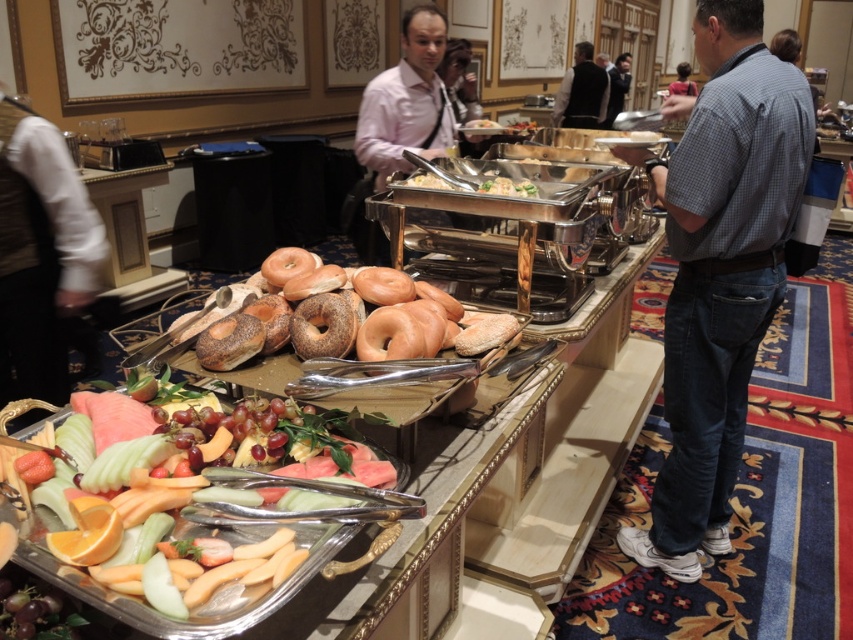
You are at a buffet and want to grab a bagel from the brown matte bagel at center. To reach it, you need to pass by the glossy metallic tray with assorted fruits at lower left. Is the path between them wide enough for you to walk through comfortably?

The glossy metallic tray with assorted fruits at lower left is positioned on the left side of brown matte bagel at center, so the path between them is likely wide enough for you to walk through comfortably as they are arranged side by side.

You are at the buffet table and want to reach both the fruit tray and the bagel arrangement. Which of the two points, point (706, 333) or point (355, 188), should you approach first to get closer to both items?

Point (706, 333) is closer to the viewer than point (355, 188), so approaching point (706, 333) first would place you closer to both the fruit tray and the bagel arrangement.